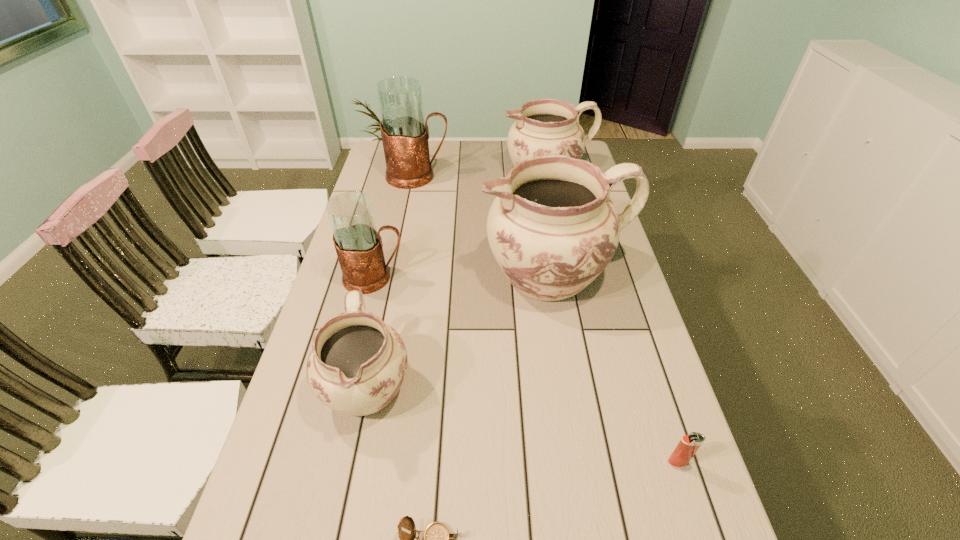
You are a GUI agent. You are given a task and a screenshot of the screen. Output one action in this format:
    pyautogui.click(x=<x>, y=<y>)
    Task: Click on the pitcher that is the closest to the sixth tallest object
    
    Given the screenshot: What is the action you would take?
    pyautogui.click(x=552, y=228)

At what (x,y) coordinates should I click in order to perform the action: click on pitcher that is the closest to the nearer gray pitcher. Please return your answer as a coordinate pair (x, y). The height and width of the screenshot is (540, 960). Looking at the image, I should click on (357, 364).

Identify the location of the second closest purple pitcher to the nearer gray pitcher. (552, 228).

Select which purple pitcher appears as the closest to the biggest purple pitcher. Please provide its 2D coordinates. Your answer should be formatted as a tuple, i.e. [(x, y)], where the tuple contains the x and y coordinates of a point satisfying the conditions above.

[(357, 364)]

Where is `free point that satisfies the following two spatial constraints: 1. on the back side of the second shortest object; 2. on the spout of the second nearest purple pitcher`? The image size is (960, 540). free point that satisfies the following two spatial constraints: 1. on the back side of the second shortest object; 2. on the spout of the second nearest purple pitcher is located at coordinates (617, 275).

At what (x,y) coordinates should I click in order to perform the action: click on vacant space that satisfies the following two spatial constraints: 1. with the handle on the side of the farther gray pitcher; 2. on the right side of the igniter. Please return your answer as a coordinate pair (x, y). The image size is (960, 540). Looking at the image, I should click on (364, 462).

This screenshot has width=960, height=540. Find the location of `vacant position in the image that satisfies the following two spatial constraints: 1. on the spout of the second smallest purple pitcher; 2. on the spout of the leftmost purple pitcher`. vacant position in the image that satisfies the following two spatial constraints: 1. on the spout of the second smallest purple pitcher; 2. on the spout of the leftmost purple pitcher is located at coordinates click(x=590, y=385).